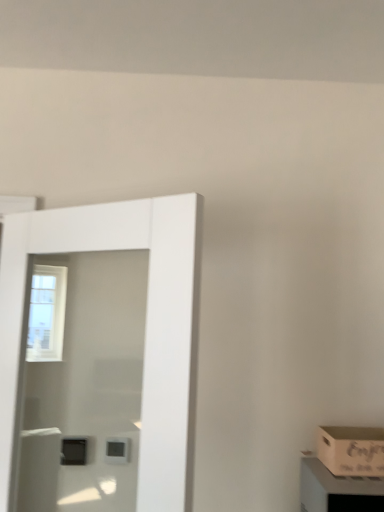
Question: Considering the relative sizes of white glossy door at left and wooden box at lower right in the image provided, is white glossy door at left thinner than wooden box at lower right?

Choices:
 (A) yes
 (B) no

Answer: (A)

Question: Does white glossy door at left have a greater height compared to wooden box at lower right?

Choices:
 (A) no
 (B) yes

Answer: (B)

Question: Does white glossy door at left contain wooden box at lower right?

Choices:
 (A) no
 (B) yes

Answer: (A)

Question: From a real-world perspective, is white glossy door at left positioned over wooden box at lower right based on gravity?

Choices:
 (A) no
 (B) yes

Answer: (B)

Question: From the image's perspective, is white glossy door at left below wooden box at lower right?

Choices:
 (A) no
 (B) yes

Answer: (A)

Question: Is white glossy door at left at the left side of wooden box at lower right?

Choices:
 (A) no
 (B) yes

Answer: (B)

Question: Is wooden crate at lower right bigger than white glossy door at left?

Choices:
 (A) no
 (B) yes

Answer: (A)

Question: Considering the relative positions of wooden crate at lower right and white glossy door at left in the image provided, is wooden crate at lower right to the left of white glossy door at left from the viewer's perspective?

Choices:
 (A) no
 (B) yes

Answer: (A)

Question: Is wooden crate at lower right placed right next to white glossy door at left?

Choices:
 (A) no
 (B) yes

Answer: (A)

Question: Is wooden crate at lower right positioned beyond the bounds of white glossy door at left?

Choices:
 (A) yes
 (B) no

Answer: (A)

Question: Is wooden crate at lower right further to the viewer compared to white glossy door at left?

Choices:
 (A) no
 (B) yes

Answer: (B)

Question: Could you tell me if wooden crate at lower right is turned towards white glossy door at left?

Choices:
 (A) no
 (B) yes

Answer: (A)

Question: Is white glossy door at left smaller than wooden crate at lower right?

Choices:
 (A) no
 (B) yes

Answer: (A)